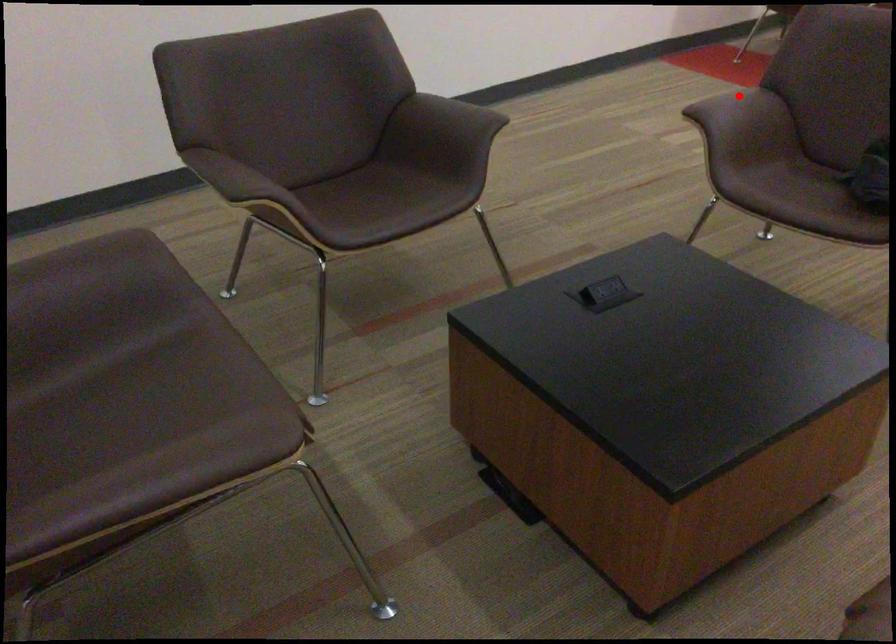
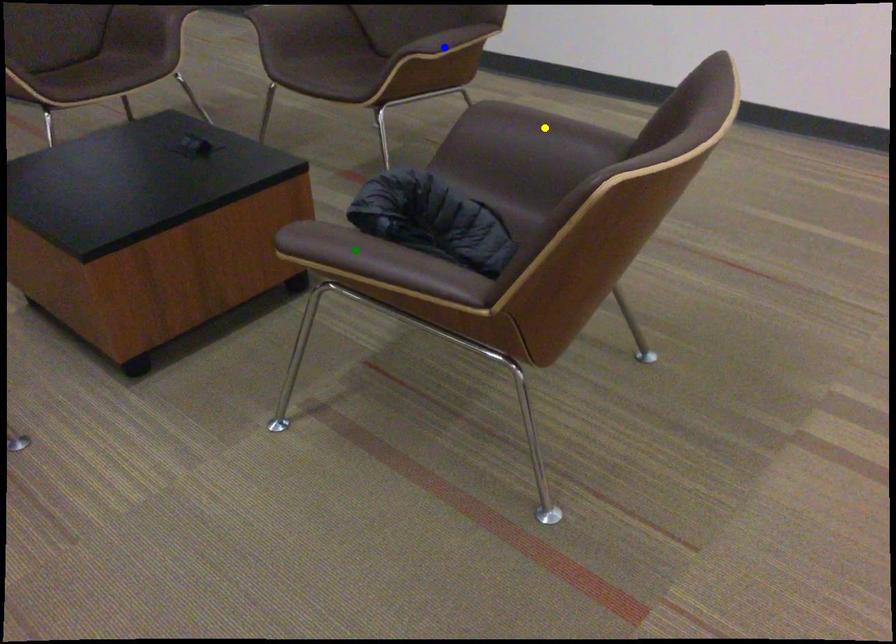
Question: I am providing you with two images of the same scene from different viewpoints. A red point is marked on the first image. You are given multiple points on the second image. Can you choose the point in image 2 that corresponds to the point in image 1?

Choices:
 (A) blue point
 (B) green point
 (C) yellow point

Answer: (C)